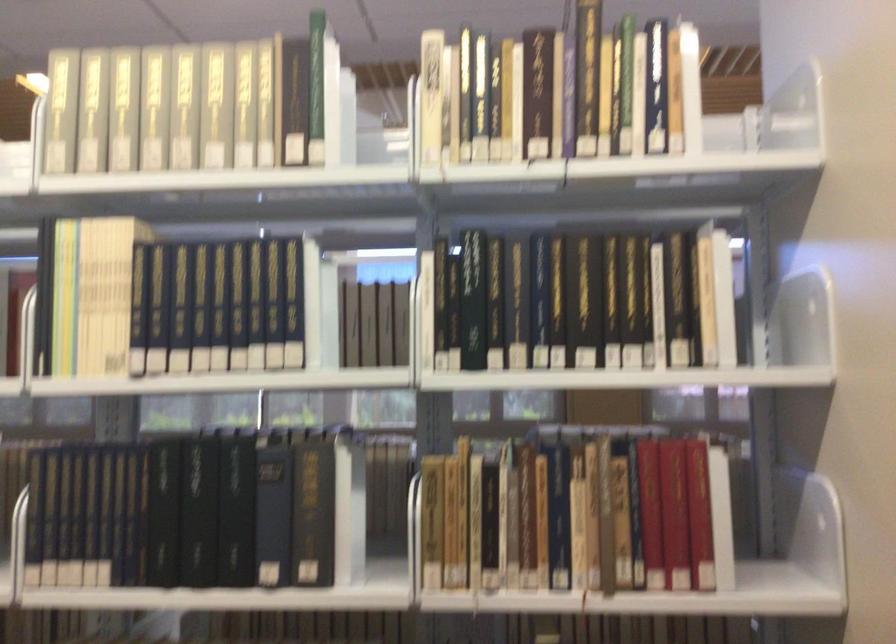
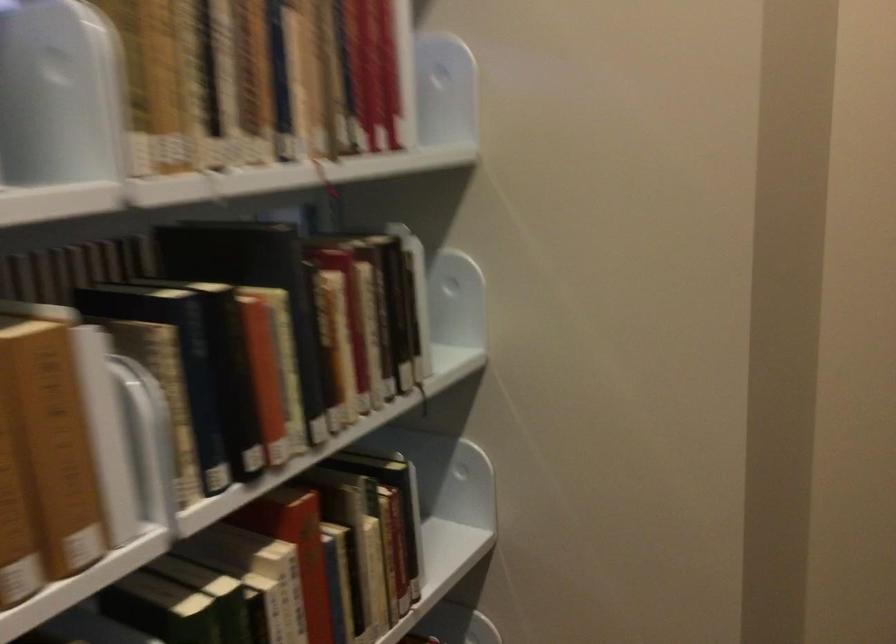
Find the pixel in the second image that matches the point at 545,532 in the first image.

(260, 80)